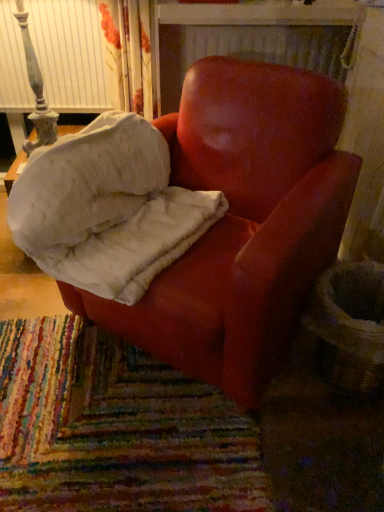
Question: Considering the relative positions of matte red armchair at center and velvet red armchair at center in the image provided, is matte red armchair at center to the left of velvet red armchair at center from the viewer's perspective?

Choices:
 (A) yes
 (B) no

Answer: (B)

Question: Would you say matte red armchair at center contains velvet red armchair at center?

Choices:
 (A) yes
 (B) no

Answer: (A)

Question: Can we say matte red armchair at center lies outside velvet red armchair at center?

Choices:
 (A) yes
 (B) no

Answer: (A)

Question: Would you say matte red armchair at center is a long distance from velvet red armchair at center?

Choices:
 (A) no
 (B) yes

Answer: (A)

Question: Considering the relative sizes of matte red armchair at center and velvet red armchair at center in the image provided, is matte red armchair at center smaller than velvet red armchair at center?

Choices:
 (A) yes
 (B) no

Answer: (B)

Question: From the image's perspective, is matte red armchair at center located beneath velvet red armchair at center?

Choices:
 (A) no
 (B) yes

Answer: (B)

Question: Does velvet red armchair at center have a lesser width compared to matte red armchair at center?

Choices:
 (A) yes
 (B) no

Answer: (A)

Question: Is velvet red armchair at center to the right of matte red armchair at center from the viewer's perspective?

Choices:
 (A) yes
 (B) no

Answer: (B)

Question: From the image's perspective, is velvet red armchair at center located above matte red armchair at center?

Choices:
 (A) no
 (B) yes

Answer: (B)

Question: From the image's perspective, is velvet red armchair at center beneath matte red armchair at center?

Choices:
 (A) no
 (B) yes

Answer: (A)

Question: Is the position of velvet red armchair at center less distant than that of matte red armchair at center?

Choices:
 (A) yes
 (B) no

Answer: (B)

Question: Does velvet red armchair at center have a greater height compared to matte red armchair at center?

Choices:
 (A) yes
 (B) no

Answer: (B)

Question: From the image's perspective, is matte red armchair at center located above or below velvet red armchair at center?

Choices:
 (A) above
 (B) below

Answer: (B)